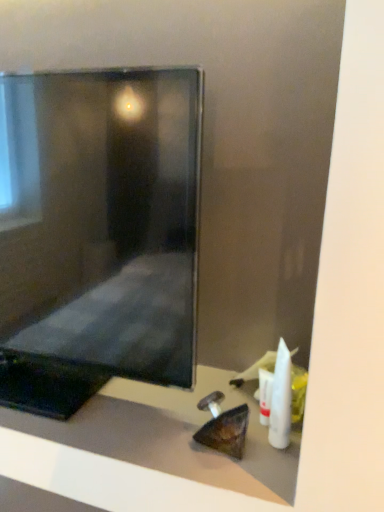
Describe the element at coordinates (171, 436) in the screenshot. The image size is (384, 512). I see `matte black monitor at center` at that location.

Where is `white plastic toothbrush at lower right, which is the second toiletry in back-to-front order`? white plastic toothbrush at lower right, which is the second toiletry in back-to-front order is located at coordinates (281, 399).

What do you see at coordinates (265, 395) in the screenshot?
I see `white plastic tube at lower right, placed as the 1th toiletry when sorted from back to front` at bounding box center [265, 395].

Locate an element on the screen. matte black monitor at center is located at coordinates (171, 436).

Which of these two, white plastic tube at lower right, placed as the 1th toiletry when sorted from back to front, or white plastic toothbrush at lower right, which ranks as the first toiletry in front-to-back order, is smaller?

Smaller between the two is white plastic tube at lower right, placed as the 1th toiletry when sorted from back to front.

Is white plastic tube at lower right, placed as the 1th toiletry when sorted from back to front, completely or partially outside of white plastic toothbrush at lower right, which is the second toiletry in back-to-front order?

Yes, white plastic tube at lower right, placed as the 1th toiletry when sorted from back to front, is not within white plastic toothbrush at lower right, which is the second toiletry in back-to-front order.

Could you tell me if white plastic tube at lower right, placed as the 1th toiletry when sorted from back to front, is turned towards white plastic toothbrush at lower right, which is the second toiletry in back-to-front order?

No, white plastic tube at lower right, placed as the 1th toiletry when sorted from back to front, is not aimed at white plastic toothbrush at lower right, which is the second toiletry in back-to-front order.

From the image's perspective, is white plastic tube at lower right, the second toiletry viewed from the front, under white plastic toothbrush at lower right, which ranks as the first toiletry in front-to-back order?

Yes, from the image's perspective, white plastic tube at lower right, the second toiletry viewed from the front, is beneath white plastic toothbrush at lower right, which ranks as the first toiletry in front-to-back order.

Is white plastic tube at lower right, the second toiletry viewed from the front, completely or partially inside matte black monitor at center?

Definitely not — white plastic tube at lower right, the second toiletry viewed from the front, is not inside matte black monitor at center.

Which is more to the left, matte black monitor at center or white plastic tube at lower right, the second toiletry viewed from the front?

From the viewer's perspective, matte black monitor at center appears more on the left side.

Does matte black monitor at center come in front of white plastic tube at lower right, placed as the 1th toiletry when sorted from back to front?

That is True.

Is matte black monitor at center aimed at white plastic tube at lower right, placed as the 1th toiletry when sorted from back to front?

No, matte black monitor at center is not facing towards white plastic tube at lower right, placed as the 1th toiletry when sorted from back to front.

From a real-world perspective, which is physically below, white plastic toothbrush at lower right, which is the second toiletry in back-to-front order, or white plastic tube at lower right, the second toiletry viewed from the front?

From a 3D spatial view, white plastic tube at lower right, the second toiletry viewed from the front, is below.

Can you see white plastic toothbrush at lower right, which ranks as the first toiletry in front-to-back order, touching white plastic tube at lower right, placed as the 1th toiletry when sorted from back to front?

Indeed, white plastic toothbrush at lower right, which ranks as the first toiletry in front-to-back order, and white plastic tube at lower right, placed as the 1th toiletry when sorted from back to front, are beside each other and touching.

Based on the photo, is white plastic toothbrush at lower right, which ranks as the first toiletry in front-to-back order, positioned with its back to white plastic tube at lower right, the second toiletry viewed from the front?

No, white plastic tube at lower right, the second toiletry viewed from the front, is not at the back of white plastic toothbrush at lower right, which ranks as the first toiletry in front-to-back order.

Can you tell me how much white plastic toothbrush at lower right, which ranks as the first toiletry in front-to-back order, and white plastic tube at lower right, the second toiletry viewed from the front, differ in facing direction?

0.00125 degrees separate the facing orientations of white plastic toothbrush at lower right, which ranks as the first toiletry in front-to-back order, and white plastic tube at lower right, the second toiletry viewed from the front.

Which object is further away from the camera, white plastic tube at lower right, the second toiletry viewed from the front, or matte black monitor at center?

Positioned behind is white plastic tube at lower right, the second toiletry viewed from the front.

From the image's perspective, would you say white plastic tube at lower right, the second toiletry viewed from the front, is shown under matte black monitor at center?

Yes, from the image's perspective, white plastic tube at lower right, the second toiletry viewed from the front, is below matte black monitor at center.

Considering the relative sizes of white plastic tube at lower right, the second toiletry viewed from the front, and matte black monitor at center in the image provided, is white plastic tube at lower right, the second toiletry viewed from the front, wider than matte black monitor at center?

In fact, white plastic tube at lower right, the second toiletry viewed from the front, might be narrower than matte black monitor at center.

Is white plastic tube at lower right, the second toiletry viewed from the front, beside matte black monitor at center?

No, white plastic tube at lower right, the second toiletry viewed from the front, is not beside matte black monitor at center.

Can you tell me how much matte black monitor at center and white plastic tube at lower right, the second toiletry viewed from the front, differ in facing direction?

0.00332 degrees.

Which of these two, matte black monitor at center or white plastic tube at lower right, the second toiletry viewed from the front, is smaller?

white plastic tube at lower right, the second toiletry viewed from the front.

Which is behind, matte black monitor at center or white plastic tube at lower right, the second toiletry viewed from the front?

white plastic tube at lower right, the second toiletry viewed from the front, is more distant.

Which is more to the right, matte black monitor at center or white plastic tube at lower right, placed as the 1th toiletry when sorted from back to front?

white plastic tube at lower right, placed as the 1th toiletry when sorted from back to front.

Is the surface of white plastic tube at lower right, the second toiletry viewed from the front, in direct contact with matte black monitor at center?

white plastic tube at lower right, the second toiletry viewed from the front, is not next to matte black monitor at center, and they're not touching.

Can you confirm if white plastic tube at lower right, placed as the 1th toiletry when sorted from back to front, is positioned to the right of matte black monitor at center?

Indeed, white plastic tube at lower right, placed as the 1th toiletry when sorted from back to front, is positioned on the right side of matte black monitor at center.

Is point (262, 407) in front of point (106, 413)?

No, (262, 407) is further to viewer.

This screenshot has width=384, height=512. What are the coordinates of `furniture in front of the white plastic tube at lower right, the second toiletry viewed from the front` in the screenshot? It's located at (171, 436).

Is white plastic toothbrush at lower right, which is the second toiletry in back-to-front order, oriented towards matte black monitor at center?

No, white plastic toothbrush at lower right, which is the second toiletry in back-to-front order, is not facing towards matte black monitor at center.

What's the angular difference between white plastic toothbrush at lower right, which is the second toiletry in back-to-front order, and matte black monitor at center's facing directions?

white plastic toothbrush at lower right, which is the second toiletry in back-to-front order, and matte black monitor at center are facing 0.00246 degrees away from each other.

From the image's perspective, which object appears higher, white plastic toothbrush at lower right, which is the second toiletry in back-to-front order, or matte black monitor at center?

matte black monitor at center.

Looking at this image, who is taller, white plastic toothbrush at lower right, which ranks as the first toiletry in front-to-back order, or matte black monitor at center?

With more height is matte black monitor at center.

I want to click on toiletry below the white plastic toothbrush at lower right, which ranks as the first toiletry in front-to-back order (from the image's perspective), so click(x=265, y=395).

Find the location of a particular element. furniture located underneath the white plastic tube at lower right, the second toiletry viewed from the front (from a real-world perspective) is located at coordinates (171, 436).

Estimate the real-world distances between objects in this image. Which object is further from matte black monitor at center, white plastic toothbrush at lower right, which is the second toiletry in back-to-front order, or white plastic tube at lower right, placed as the 1th toiletry when sorted from back to front?

white plastic toothbrush at lower right, which is the second toiletry in back-to-front order, lies further to matte black monitor at center than the other object.

When comparing their distances from matte black monitor at center, does white plastic toothbrush at lower right, which ranks as the first toiletry in front-to-back order, or matte black monitor at center seem further?

white plastic toothbrush at lower right, which ranks as the first toiletry in front-to-back order, lies further to matte black monitor at center than the other object.

Which object lies further to the anchor point white plastic toothbrush at lower right, which ranks as the first toiletry in front-to-back order, matte black monitor at center or matte black monitor at center?

matte black monitor at center lies further to white plastic toothbrush at lower right, which ranks as the first toiletry in front-to-back order, than the other object.

From the image, which object appears to be nearer to matte black monitor at center, matte black monitor at center or white plastic toothbrush at lower right, which ranks as the first toiletry in front-to-back order?

The object closer to matte black monitor at center is matte black monitor at center.

From the image, which object appears to be farther from white plastic toothbrush at lower right, which ranks as the first toiletry in front-to-back order, matte black monitor at center or white plastic tube at lower right, the second toiletry viewed from the front?

matte black monitor at center is further to white plastic toothbrush at lower right, which ranks as the first toiletry in front-to-back order.

Which object lies nearer to the anchor point white plastic tube at lower right, placed as the 1th toiletry when sorted from back to front, white plastic toothbrush at lower right, which ranks as the first toiletry in front-to-back order, or matte black monitor at center?

The object closer to white plastic tube at lower right, placed as the 1th toiletry when sorted from back to front, is white plastic toothbrush at lower right, which ranks as the first toiletry in front-to-back order.

From the image, which object appears to be farther from matte black monitor at center, white plastic tube at lower right, placed as the 1th toiletry when sorted from back to front, or matte black monitor at center?

matte black monitor at center is positioned further to the anchor matte black monitor at center.

Considering their positions, is matte black monitor at center positioned further to white plastic toothbrush at lower right, which ranks as the first toiletry in front-to-back order, than white plastic tube at lower right, the second toiletry viewed from the front?

The object further to white plastic toothbrush at lower right, which ranks as the first toiletry in front-to-back order, is matte black monitor at center.

Locate an element on the screen. The height and width of the screenshot is (512, 384). furniture between matte black monitor at center and white plastic toothbrush at lower right, which ranks as the first toiletry in front-to-back order, from left to right is located at coordinates coord(171,436).

Where is `toiletry situated between matte black monitor at center and white plastic toothbrush at lower right, which ranks as the first toiletry in front-to-back order, from left to right`? The height and width of the screenshot is (512, 384). toiletry situated between matte black monitor at center and white plastic toothbrush at lower right, which ranks as the first toiletry in front-to-back order, from left to right is located at coordinates (265, 395).

Identify the location of furniture between matte black monitor at center and white plastic tube at lower right, placed as the 1th toiletry when sorted from back to front, in the horizontal direction. The width and height of the screenshot is (384, 512). (171, 436).

This screenshot has width=384, height=512. I want to click on toiletry between matte black monitor at center and white plastic toothbrush at lower right, which ranks as the first toiletry in front-to-back order, in the horizontal direction, so click(265, 395).